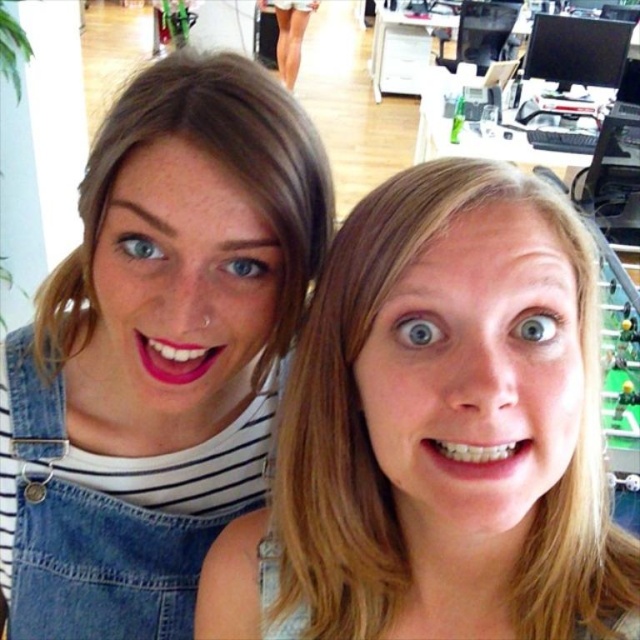
Question: Which of these objects is positioned farthest from the denim overalls at left?

Choices:
 (A) matte denim overalls at center
 (B) matte denim overalls at left

Answer: (A)

Question: Does denim overalls at left appear over matte denim overalls at left?

Choices:
 (A) no
 (B) yes

Answer: (A)

Question: Among these points, which one is nearest to the camera?

Choices:
 (A) (28, 529)
 (B) (67, 340)
 (C) (452, 545)

Answer: (C)

Question: Which point is farther to the camera?

Choices:
 (A) (560, 592)
 (B) (88, 324)
 (C) (124, 625)

Answer: (C)

Question: Does denim overalls at left have a smaller size compared to matte denim overalls at left?

Choices:
 (A) yes
 (B) no

Answer: (A)

Question: Is matte denim overalls at center thinner than matte denim overalls at left?

Choices:
 (A) no
 (B) yes

Answer: (A)